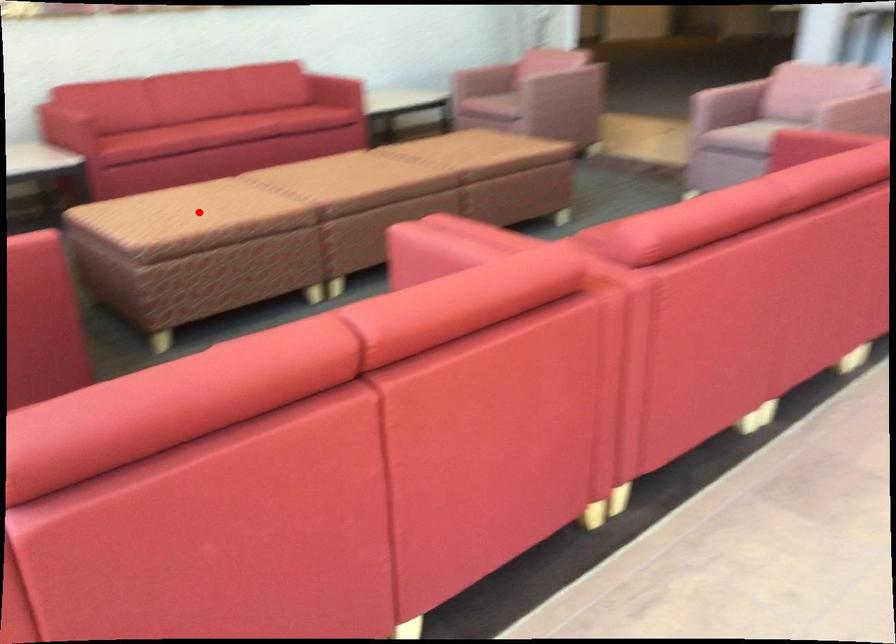
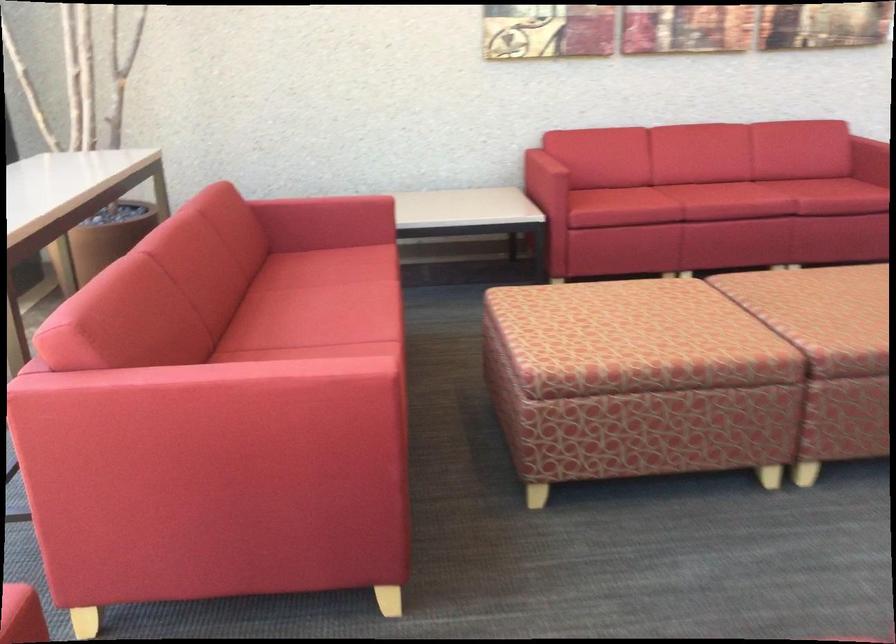
Find the pixel in the second image that matches the highlighted location in the first image.

(627, 334)